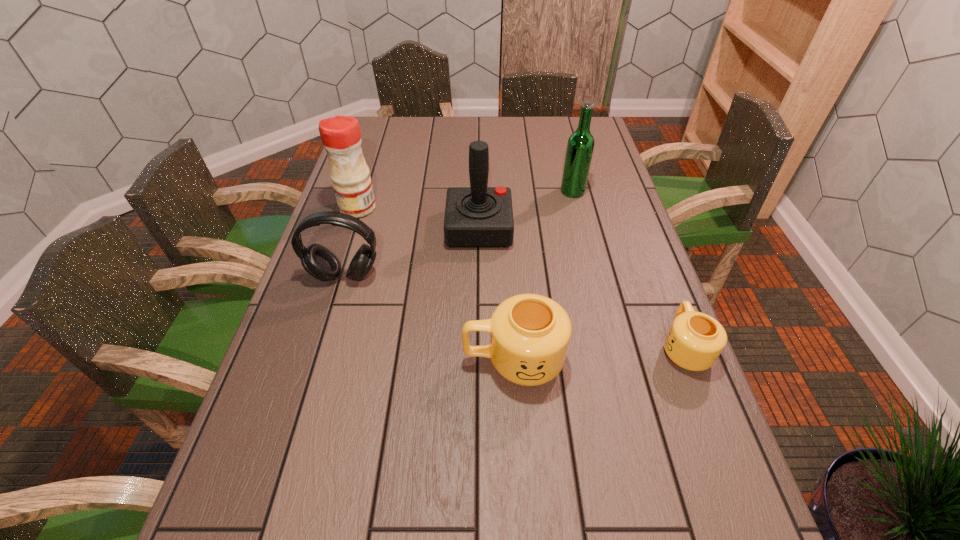
You are a GUI agent. You are given a task and a screenshot of the screen. Output one action in this format:
    pyautogui.click(x=<x>, y=<y>)
    Task: Click on the free spot that satisfies the following two spatial constraints: 1. on the handle side of the shortest object; 2. on the base of the joystick
    The height and width of the screenshot is (540, 960).
    Given the screenshot: What is the action you would take?
    pyautogui.click(x=637, y=228)

Image resolution: width=960 pixels, height=540 pixels. I want to click on vacant area that satisfies the following two spatial constraints: 1. on the back side of the condiment; 2. on the left side of the beer bottle, so click(x=364, y=191).